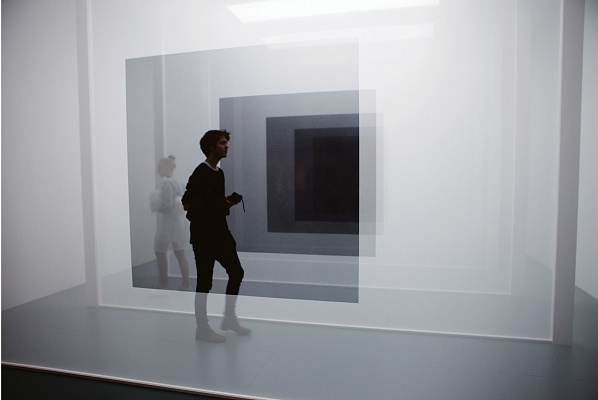
The image size is (598, 400). In order to click on floor in this screenshot , I will do `click(378, 370)`.